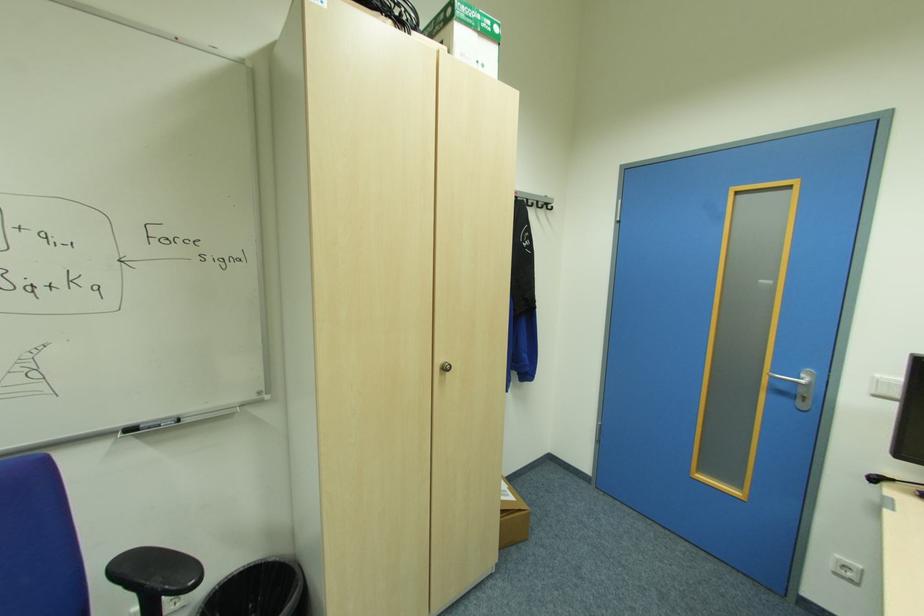
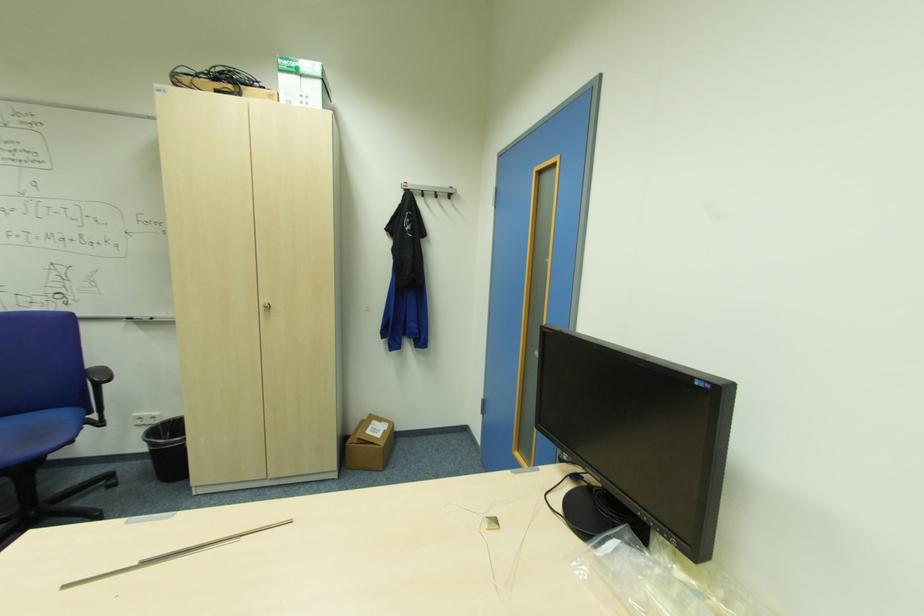
Question: Which direction would the cameraman need to move to produce the second image? Reply with the corresponding letter.

Choices:
 (A) Left
 (B) Right
 (C) Forward
 (D) Backward

Answer: (B)